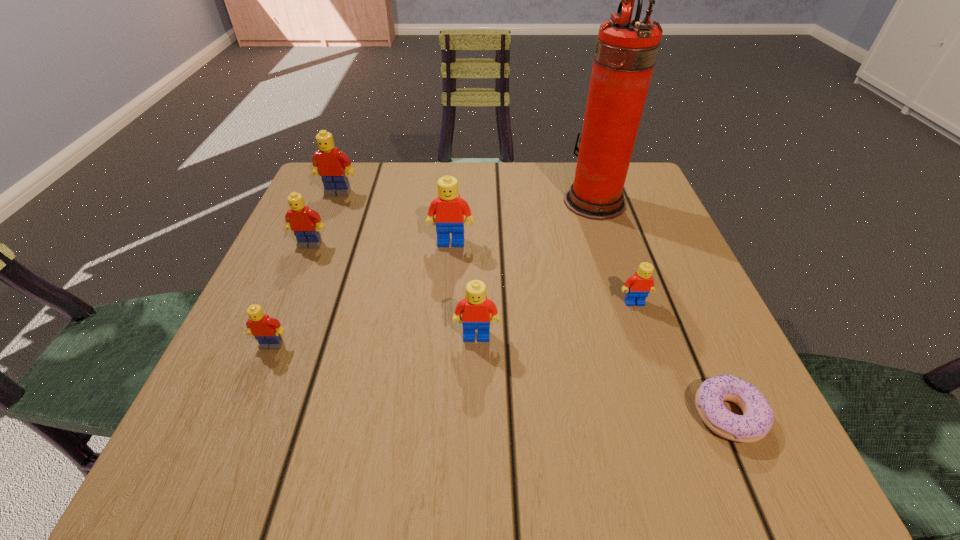
Locate an element on the screen. the tallest object is located at coordinates (626, 50).

Locate an element on the screen. Image resolution: width=960 pixels, height=540 pixels. the farthest yellow Lego is located at coordinates (329, 163).

The image size is (960, 540). In order to click on the farthest Lego in this screenshot , I will do `click(329, 163)`.

This screenshot has height=540, width=960. What are the coordinates of `the farthest red Lego` in the screenshot? It's located at (449, 208).

In order to click on the second farthest yellow Lego in this screenshot , I will do tap(301, 219).

Image resolution: width=960 pixels, height=540 pixels. Find the location of `the nearest red Lego`. the nearest red Lego is located at coordinates (475, 308).

Locate an element on the screen. the third nearest Lego is located at coordinates (638, 286).

This screenshot has height=540, width=960. In order to click on the rightmost Lego in this screenshot , I will do `click(638, 286)`.

Locate an element on the screen. The height and width of the screenshot is (540, 960). the nearest yellow Lego is located at coordinates (266, 330).

Find the location of `the shortest object`. the shortest object is located at coordinates (757, 419).